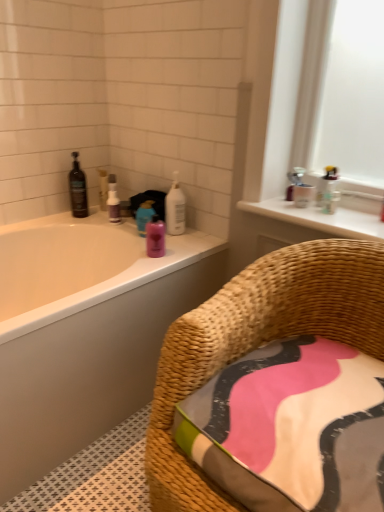
Locate an element on the screen. The width and height of the screenshot is (384, 512). vacant space to the right of pink glossy bottle at upper center, which appears as the 2th toiletry when viewed from the right is located at coordinates (185, 249).